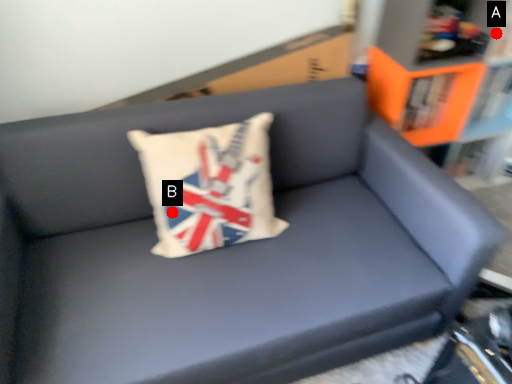
Question: Two points are circled on the image, labeled by A and B beside each circle. Which point is closer to the camera?

Choices:
 (A) A is closer
 (B) B is closer

Answer: (B)